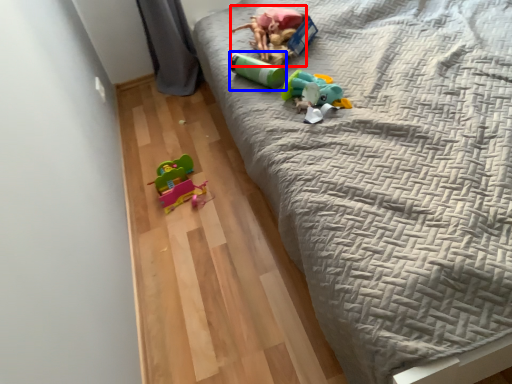
Question: Among these objects, which one is farthest to the camera, toy (highlighted by a red box) or toy (highlighted by a blue box)?

Choices:
 (A) toy
 (B) toy

Answer: (A)